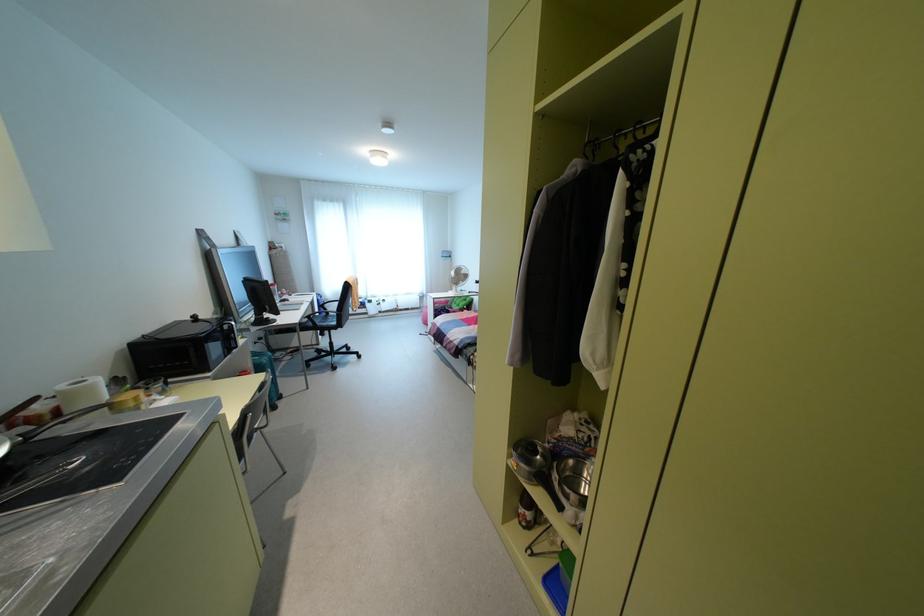
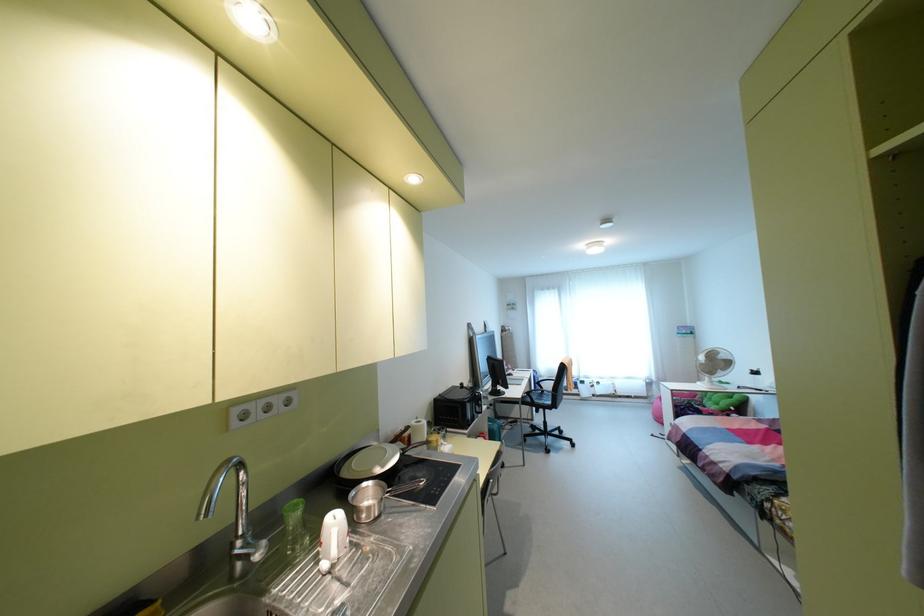
Question: The images are taken continuously from a first-person perspective. In which direction is your viewpoint rotating?

Choices:
 (A) Left
 (B) Right
 (C) Up
 (D) Down

Answer: (A)